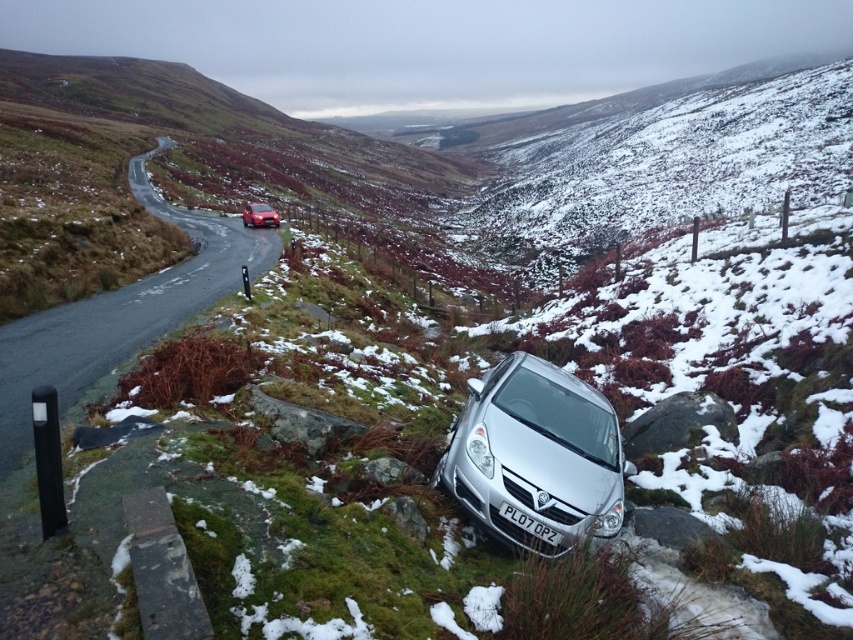
Is silver metallic car at lower center shorter than metallic red car at center?

Yes, silver metallic car at lower center is shorter than metallic red car at center.

Who is positioned more to the left, silver metallic car at lower center or metallic red car at center?

Positioned to the left is metallic red car at center.

What do you see at coordinates (535, 458) in the screenshot? I see `silver metallic car at lower center` at bounding box center [535, 458].

I want to click on silver metallic car at lower center, so pyautogui.click(x=535, y=458).

At what (x,y) coordinates should I click in order to perform the action: click on silver metallic license plate at lower center. Please return your answer as a coordinate pair (x, y). Image resolution: width=853 pixels, height=640 pixels. Looking at the image, I should click on (529, 524).

Can you confirm if silver metallic car at lower center is smaller than smooth asphalt road at upper left?

Correct, silver metallic car at lower center occupies less space than smooth asphalt road at upper left.

Does silver metallic car at lower center appear over smooth asphalt road at upper left?

No, silver metallic car at lower center is not above smooth asphalt road at upper left.

Where is `silver metallic car at lower center`? The width and height of the screenshot is (853, 640). silver metallic car at lower center is located at coordinates (535, 458).

This screenshot has height=640, width=853. Identify the location of silver metallic car at lower center. (535, 458).